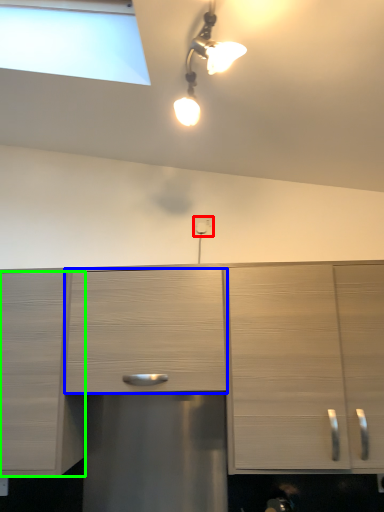
Question: Based on their relative distances, which object is nearer to electric outlet (highlighted by a red box)? Choose from drawer (highlighted by a blue box) and cabinetry (highlighted by a green box).

Choices:
 (A) drawer
 (B) cabinetry

Answer: (A)